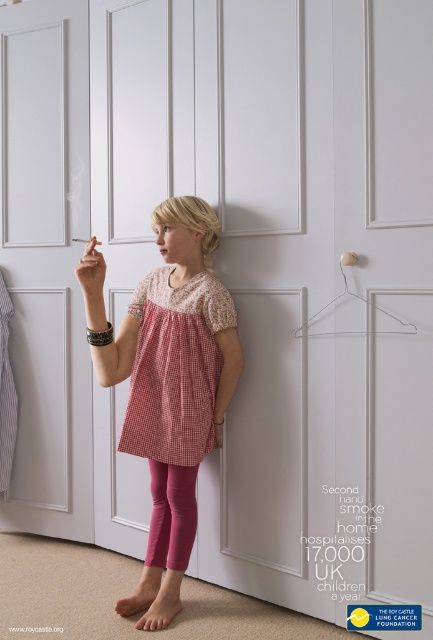
Which is below, white wood door at center or matte pink leggings at center?

Positioned lower is matte pink leggings at center.

Is white wood door at center in front of matte pink leggings at center?

No, it is behind matte pink leggings at center.

This screenshot has height=640, width=433. What do you see at coordinates (47, 262) in the screenshot?
I see `white wood door at center` at bounding box center [47, 262].

Identify the location of white wood door at center. (47, 262).

Which is in front, point (70, 216) or point (84, 241)?

Point (84, 241)

Between white wood door at center and matte plastic cigarette at upper center, which one is positioned higher?

matte plastic cigarette at upper center is above.

Measure the distance between white wood door at center and camera.

white wood door at center is 2.64 meters away from camera.

You are a GUI agent. You are given a task and a screenshot of the screen. Output one action in this format:
    pyautogui.click(x=<x>, y=<y>)
    Task: Click on the white wood door at center
    The image size is (433, 640).
    Given the screenshot: What is the action you would take?
    pyautogui.click(x=47, y=262)

Is white wood door at center bigger than pink smooth leggings at lower center?

Correct, white wood door at center is larger in size than pink smooth leggings at lower center.

Can you confirm if white wood door at center is positioned above pink smooth leggings at lower center?

Correct, white wood door at center is located above pink smooth leggings at lower center.

Who is more distant from viewer, (58, 3) or (161, 506)?

The point (58, 3) is more distant.

The width and height of the screenshot is (433, 640). Find the location of `white wood door at center`. white wood door at center is located at coordinates (47, 262).